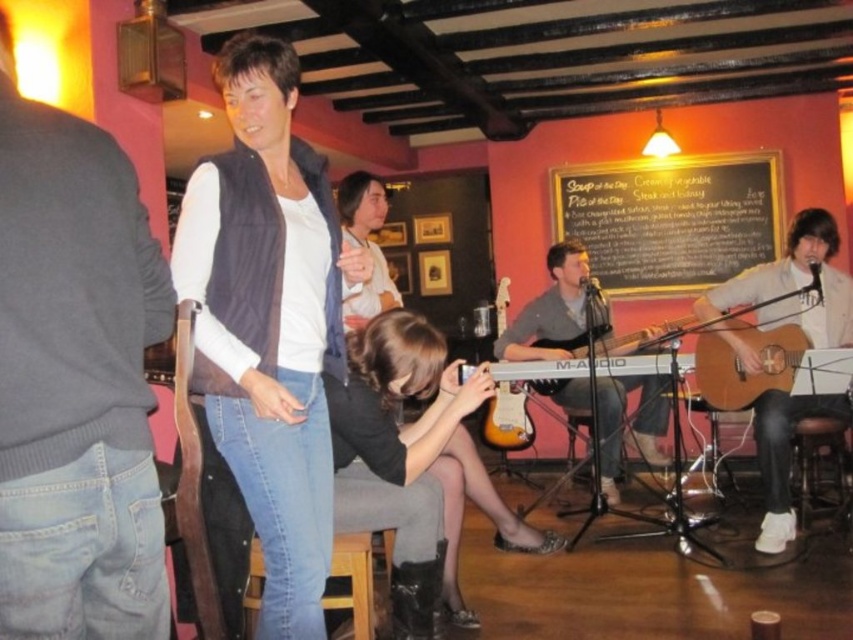
Can you confirm if wooden acoustic guitar at center is positioned to the left of satin wood electric guitar at center?

No, wooden acoustic guitar at center is not to the left of satin wood electric guitar at center.

This screenshot has width=853, height=640. What are the coordinates of `wooden acoustic guitar at center` in the screenshot? It's located at (550, 308).

Measure the distance from gray cotton sweater at left to black chalkboard at upper center.

gray cotton sweater at left and black chalkboard at upper center are 15.22 feet apart from each other.

This screenshot has height=640, width=853. Describe the element at coordinates (74, 380) in the screenshot. I see `gray cotton sweater at left` at that location.

Find the location of a particular element. gray cotton sweater at left is located at coordinates (74, 380).

At what (x,y) coordinates should I click in order to perform the action: click on gray cotton sweater at left. Please return your answer as a coordinate pair (x, y). Looking at the image, I should click on (74, 380).

Between black leather boots at lower center and smooth brown hair at center, which one has more height?

With more height is black leather boots at lower center.

From the picture: Between black leather boots at lower center and smooth brown hair at center, which one appears on the right side from the viewer's perspective?

black leather boots at lower center is more to the right.

Is point (375, 360) farther from camera compared to point (358, 211)?

No, it is not.

Where is `black leather boots at lower center`? The image size is (853, 640). black leather boots at lower center is located at coordinates (415, 461).